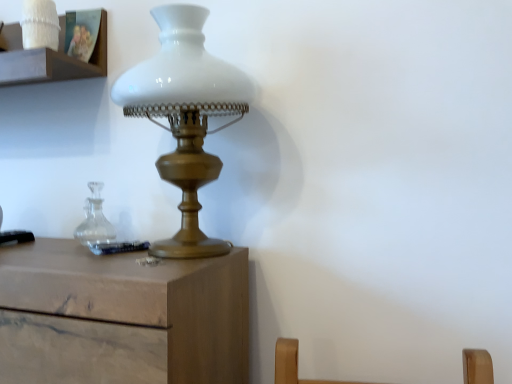
Image resolution: width=512 pixels, height=384 pixels. I want to click on white ceramic candle holder at upper left, so click(40, 24).

Image resolution: width=512 pixels, height=384 pixels. Describe the element at coordinates (40, 24) in the screenshot. I see `white ceramic candle holder at upper left` at that location.

You are a GUI agent. You are given a task and a screenshot of the screen. Output one action in this format:
    pyautogui.click(x=<x>, y=<y>)
    Task: Click on the white matte glass lamp at center
    The height and width of the screenshot is (384, 512).
    Given the screenshot: What is the action you would take?
    pyautogui.click(x=185, y=116)

This screenshot has width=512, height=384. What do you see at coordinates (185, 116) in the screenshot? I see `white matte glass lamp at center` at bounding box center [185, 116].

You are a GUI agent. You are given a task and a screenshot of the screen. Output one action in this format:
    pyautogui.click(x=<x>, y=<y>)
    Task: Click on the white ceramic candle holder at upper left
    
    Given the screenshot: What is the action you would take?
    pyautogui.click(x=40, y=24)

Can you confirm if white ceramic candle holder at upper left is positioned to the right of white matte glass lamp at center?

No, white ceramic candle holder at upper left is not to the right of white matte glass lamp at center.

In the image, is white ceramic candle holder at upper left positioned in front of or behind white matte glass lamp at center?

Clearly, white ceramic candle holder at upper left is behind white matte glass lamp at center.

Between point (36, 19) and point (204, 165), which one is positioned behind?

The point (36, 19) is farther.

From the image's perspective, which object appears higher, white ceramic candle holder at upper left or white matte glass lamp at center?

white ceramic candle holder at upper left, from the image's perspective.

From a real-world perspective, which is physically above, white ceramic candle holder at upper left or white matte glass lamp at center?

In real-world perspective, white ceramic candle holder at upper left is above.

Is white ceramic candle holder at upper left thinner than white matte glass lamp at center?

Correct, the width of white ceramic candle holder at upper left is less than that of white matte glass lamp at center.

Is white ceramic candle holder at upper left taller than white matte glass lamp at center?

Incorrect, the height of white ceramic candle holder at upper left is not larger of that of white matte glass lamp at center.

Does white ceramic candle holder at upper left have a larger size compared to white matte glass lamp at center?

Incorrect, white ceramic candle holder at upper left is not larger than white matte glass lamp at center.

Would you say white ceramic candle holder at upper left contains white matte glass lamp at center?

Definitely not — white matte glass lamp at center is not inside white ceramic candle holder at upper left.

Are white ceramic candle holder at upper left and white matte glass lamp at center making contact?

No, white ceramic candle holder at upper left is not making contact with white matte glass lamp at center.

Is white ceramic candle holder at upper left oriented towards white matte glass lamp at center?

No, white ceramic candle holder at upper left is not facing towards white matte glass lamp at center.

I want to click on lamp to the right of white ceramic candle holder at upper left, so click(x=185, y=116).

Is white matte glass lamp at center to the left of white ceramic candle holder at upper left from the viewer's perspective?

No, white matte glass lamp at center is not to the left of white ceramic candle holder at upper left.

Is the depth of white matte glass lamp at center greater than that of white ceramic candle holder at upper left?

No, the depth of white matte glass lamp at center is less than that of white ceramic candle holder at upper left.

Is point (155, 244) more distant than point (54, 18)?

That is False.

From the image's perspective, is white matte glass lamp at center under white ceramic candle holder at upper left?

Yes.

From a real-world perspective, is white matte glass lamp at center beneath white ceramic candle holder at upper left?

Correct, in the physical world, white matte glass lamp at center is lower than white ceramic candle holder at upper left.

Looking at their sizes, would you say white matte glass lamp at center is wider or thinner than white ceramic candle holder at upper left?

In the image, white matte glass lamp at center appears to be wider than white ceramic candle holder at upper left.

Does white matte glass lamp at center have a lesser height compared to white ceramic candle holder at upper left?

Incorrect, the height of white matte glass lamp at center does not fall short of that of white ceramic candle holder at upper left.

Is white matte glass lamp at center bigger than white ceramic candle holder at upper left?

Correct, white matte glass lamp at center is larger in size than white ceramic candle holder at upper left.

Would you say white matte glass lamp at center is inside or outside white ceramic candle holder at upper left?

white matte glass lamp at center is located beyond the bounds of white ceramic candle holder at upper left.

Would you say white matte glass lamp at center is a long distance from white ceramic candle holder at upper left?

No, there isn't a large distance between white matte glass lamp at center and white ceramic candle holder at upper left.

Is white matte glass lamp at center aimed at white ceramic candle holder at upper left?

No, white matte glass lamp at center is not aimed at white ceramic candle holder at upper left.

How different are the orientations of white matte glass lamp at center and white ceramic candle holder at upper left in degrees?

1.13 degrees.

Where is `candle holder above the white matte glass lamp at center (from the image's perspective)`? The width and height of the screenshot is (512, 384). candle holder above the white matte glass lamp at center (from the image's perspective) is located at coordinates (40, 24).

The height and width of the screenshot is (384, 512). I want to click on candle holder to the left of white matte glass lamp at center, so click(40, 24).

This screenshot has height=384, width=512. I want to click on candle holder above the white matte glass lamp at center (from a real-world perspective), so click(40, 24).